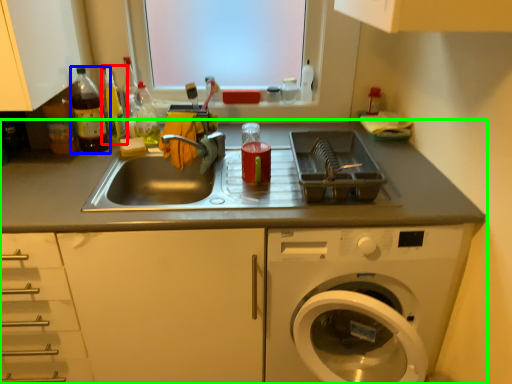
Question: Which object is the closest to the bottle (highlighted by a red box)? Choose among these: bottle (highlighted by a blue box) or countertop (highlighted by a green box).

Choices:
 (A) bottle
 (B) countertop

Answer: (A)